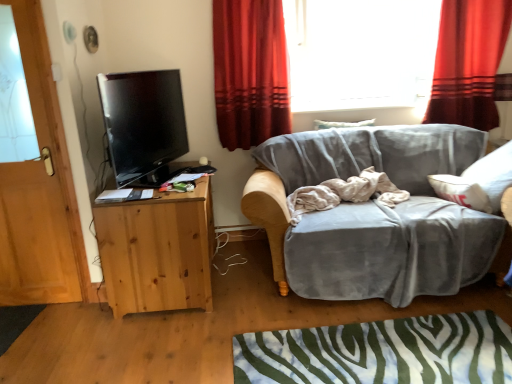
Question: Is natural wood cabinet at left bigger than wooden door at left?

Choices:
 (A) no
 (B) yes

Answer: (B)

Question: Is natural wood cabinet at left thinner than wooden door at left?

Choices:
 (A) no
 (B) yes

Answer: (A)

Question: Is natural wood cabinet at left wider than wooden door at left?

Choices:
 (A) no
 (B) yes

Answer: (B)

Question: Considering the relative positions of natural wood cabinet at left and wooden door at left in the image provided, is natural wood cabinet at left to the right of wooden door at left from the viewer's perspective?

Choices:
 (A) no
 (B) yes

Answer: (B)

Question: Is natural wood cabinet at left in front of wooden door at left?

Choices:
 (A) no
 (B) yes

Answer: (A)

Question: Would you say wooden door at left is part of natural wood cabinet at left's contents?

Choices:
 (A) yes
 (B) no

Answer: (B)

Question: Is natural wood cabinet at left located within red velvet curtain at upper right, which is the 2th curtain in left-to-right order?

Choices:
 (A) no
 (B) yes

Answer: (A)

Question: From the image's perspective, does red velvet curtain at upper right, which is the 2th curtain in left-to-right order, appear lower than natural wood cabinet at left?

Choices:
 (A) yes
 (B) no

Answer: (B)

Question: From a real-world perspective, is red velvet curtain at upper right, which is the 2th curtain in left-to-right order, physically above natural wood cabinet at left?

Choices:
 (A) yes
 (B) no

Answer: (A)

Question: Can you confirm if red velvet curtain at upper right, which is the 2th curtain in left-to-right order, is bigger than natural wood cabinet at left?

Choices:
 (A) yes
 (B) no

Answer: (B)

Question: From the image's perspective, is red velvet curtain at upper right, which is the 2th curtain in left-to-right order, on top of natural wood cabinet at left?

Choices:
 (A) no
 (B) yes

Answer: (B)

Question: Is red velvet curtain at upper right, which is the 2th curtain in left-to-right order, wider than natural wood cabinet at left?

Choices:
 (A) yes
 (B) no

Answer: (B)

Question: Considering the relative sizes of natural wood cabinet at left and red velvet curtain at upper right, which is the 2th curtain in left-to-right order, in the image provided, is natural wood cabinet at left taller than red velvet curtain at upper right, which is the 2th curtain in left-to-right order,?

Choices:
 (A) yes
 (B) no

Answer: (B)